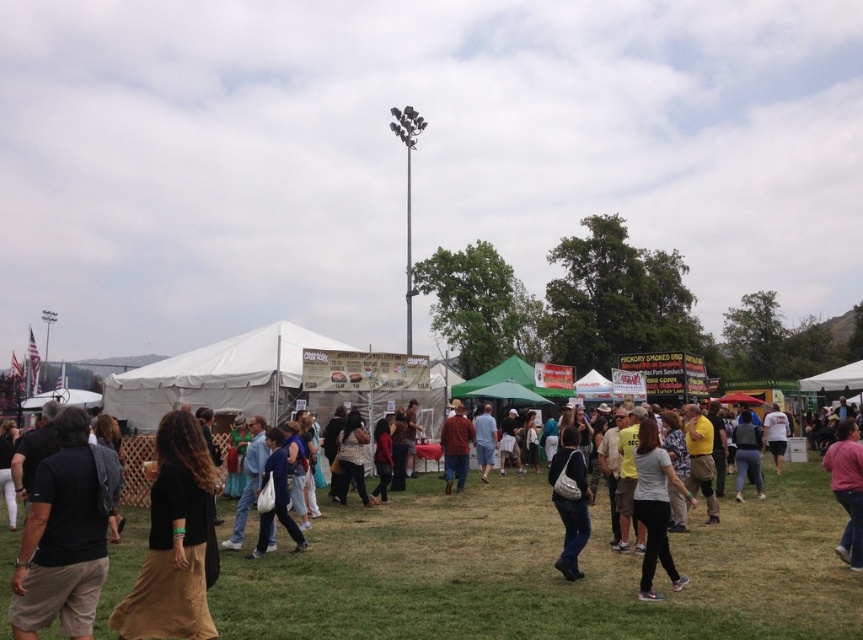
Which is in front, point (559, 518) or point (452, 442)?

Point (559, 518) is more forward.

Does matte black pants at center have a greater width compared to matte red shirt at center?

Yes.

Locate an element on the screen. matte black pants at center is located at coordinates (570, 502).

Who is taller, black cotton shirt at center or white matte shirt at center?

With more height is white matte shirt at center.

Does black cotton shirt at center appear on the left side of white matte shirt at center?

Yes, black cotton shirt at center is to the left of white matte shirt at center.

Where is `black cotton shirt at center`? black cotton shirt at center is located at coordinates (174, 540).

Is point (551, 605) positioned in front of point (46, 500)?

No, (551, 605) is further to viewer.

Does point (427, 628) come farther from viewer compared to point (60, 477)?

Yes, point (427, 628) is farther from viewer.

Image resolution: width=863 pixels, height=640 pixels. What do you see at coordinates (545, 572) in the screenshot?
I see `green grass at lower center` at bounding box center [545, 572].

The height and width of the screenshot is (640, 863). Find the location of `green grass at lower center`. green grass at lower center is located at coordinates click(x=545, y=572).